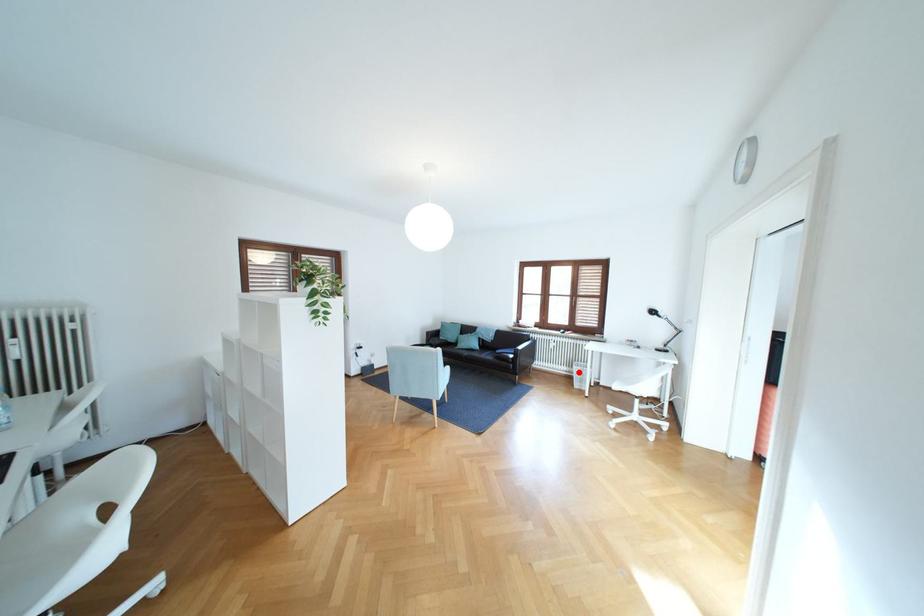
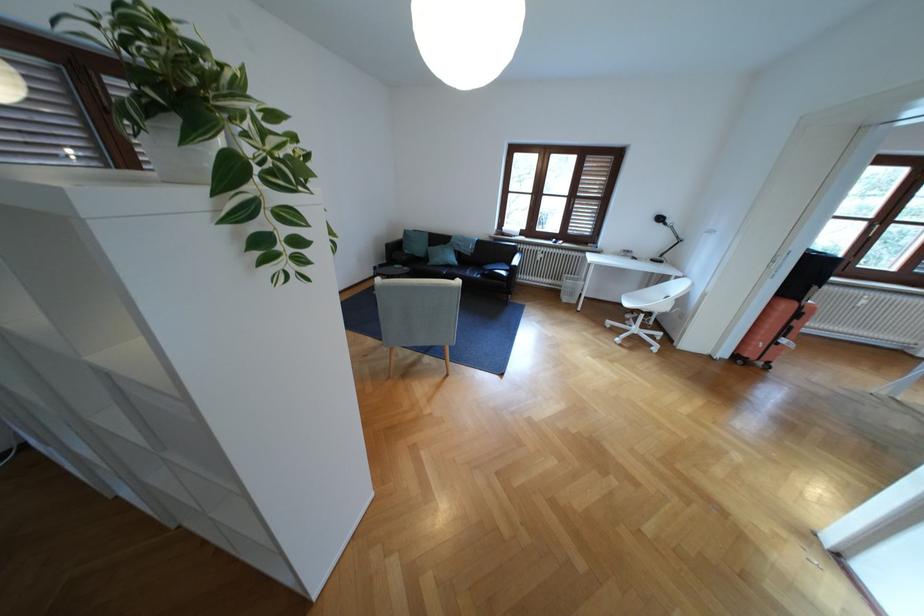
Locate, in the second image, the point that corresponds to the highlighted location in the first image.

(563, 285)